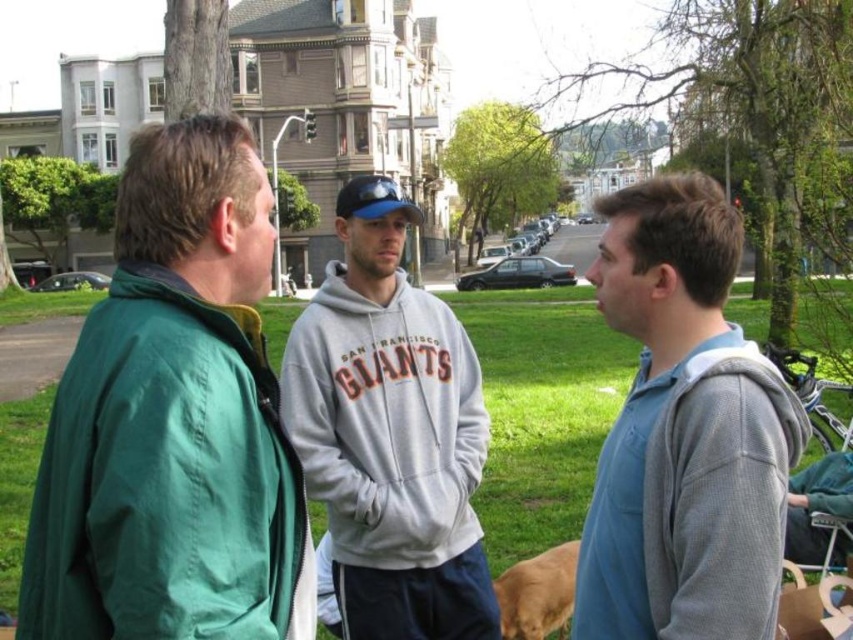
Can you confirm if green matte jacket at left is bigger than golden fur dog at lower center?

Indeed, green matte jacket at left has a larger size compared to golden fur dog at lower center.

Between point (216, 282) and point (502, 580), which one is positioned in front?

Positioned in front is point (216, 282).

Who is more forward, (49, 541) or (524, 600)?

Point (49, 541)

Image resolution: width=853 pixels, height=640 pixels. I want to click on green matte jacket at left, so click(172, 420).

In the scene shown: Is green matte jacket at left bigger than gray fleece jacket at center?

→ Correct, green matte jacket at left is larger in size than gray fleece jacket at center.

Does green matte jacket at left have a greater width compared to gray fleece jacket at center?

Yes, green matte jacket at left is wider than gray fleece jacket at center.

Does point (192, 541) come in front of point (723, 618)?

Yes, point (192, 541) is in front of point (723, 618).

Find the location of a particular element. green matte jacket at left is located at coordinates 172,420.

Is gray fleece jacket at center wider than gray fleece sweatshirt at center?

In fact, gray fleece jacket at center might be narrower than gray fleece sweatshirt at center.

Between point (671, 282) and point (344, 436), which one is positioned in front?

Point (671, 282)

The width and height of the screenshot is (853, 640). What are the coordinates of `gray fleece jacket at center` in the screenshot? It's located at (683, 433).